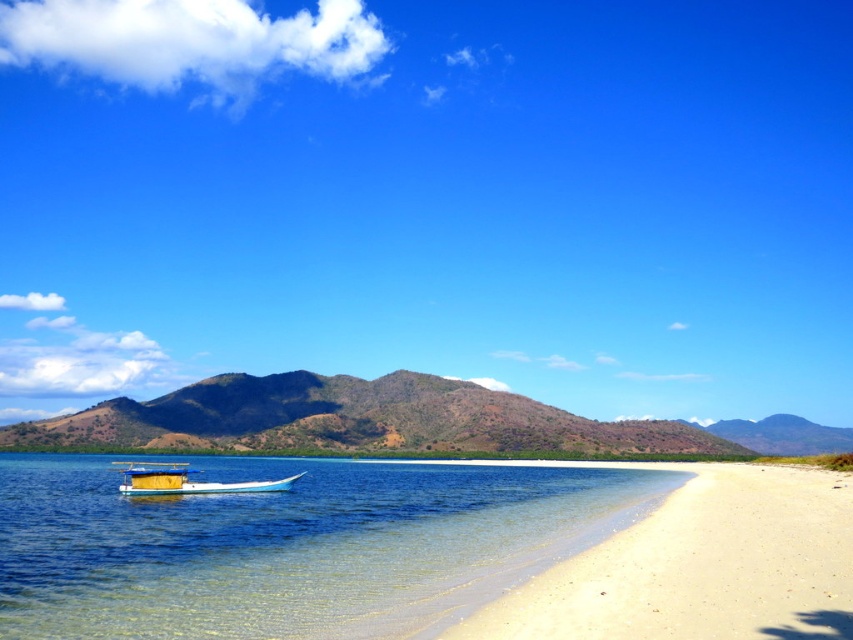
Question: Which point is closer to the camera?

Choices:
 (A) white sandy beach at lower right
 (B) clear water at lower left
 (C) wooden boat at center
 (D) brown/drymountain at center

Answer: (A)

Question: Is brown/drymountain at center to the left of wooden boat at center from the viewer's perspective?

Choices:
 (A) no
 (B) yes

Answer: (A)

Question: Can you confirm if white sandy beach at lower right is smaller than wooden boat at center?

Choices:
 (A) no
 (B) yes

Answer: (B)

Question: Which object appears closest to the camera in this image?

Choices:
 (A) white sandy beach at lower right
 (B) clear water at lower left
 (C) wooden boat at center

Answer: (A)

Question: Which object is positioned farthest from the clear water at lower left?

Choices:
 (A) white sandy beach at lower right
 (B) brown/drymountain at center

Answer: (B)

Question: Is white sandy beach at lower right wider than brown/drymountain at center?

Choices:
 (A) no
 (B) yes

Answer: (A)